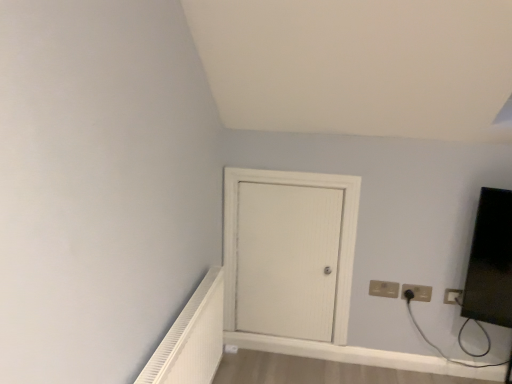
Question: Is white wood door at center completely or partially outside of white textured radiator at lower left?

Choices:
 (A) yes
 (B) no

Answer: (A)

Question: Can you confirm if white wood door at center is smaller than white textured radiator at lower left?

Choices:
 (A) yes
 (B) no

Answer: (A)

Question: Can you confirm if white wood door at center is thinner than white textured radiator at lower left?

Choices:
 (A) yes
 (B) no

Answer: (A)

Question: Is white wood door at center shorter than white textured radiator at lower left?

Choices:
 (A) yes
 (B) no

Answer: (B)

Question: Are white wood door at center and white textured radiator at lower left making contact?

Choices:
 (A) yes
 (B) no

Answer: (B)

Question: Are white wood door at center and white textured radiator at lower left far apart?

Choices:
 (A) no
 (B) yes

Answer: (A)

Question: From a real-world perspective, does white plastic electric outlet at upper right, the third electric outlet when ordered from left to right, sit lower than white wood door at center?

Choices:
 (A) no
 (B) yes

Answer: (B)

Question: Considering the relative sizes of white plastic electric outlet at upper right, marked as the 1th electric outlet in a right-to-left arrangement, and white wood door at center in the image provided, is white plastic electric outlet at upper right, marked as the 1th electric outlet in a right-to-left arrangement, bigger than white wood door at center?

Choices:
 (A) yes
 (B) no

Answer: (B)

Question: From a real-world perspective, is white plastic electric outlet at upper right, marked as the 1th electric outlet in a right-to-left arrangement, on top of white wood door at center?

Choices:
 (A) no
 (B) yes

Answer: (A)

Question: Considering the relative positions of white plastic electric outlet at upper right, the third electric outlet when ordered from left to right, and white wood door at center in the image provided, is white plastic electric outlet at upper right, the third electric outlet when ordered from left to right, to the left of white wood door at center from the viewer's perspective?

Choices:
 (A) no
 (B) yes

Answer: (A)

Question: Can you confirm if white plastic electric outlet at upper right, marked as the 1th electric outlet in a right-to-left arrangement, is taller than white wood door at center?

Choices:
 (A) no
 (B) yes

Answer: (A)

Question: Is white plastic electric outlet at upper right, marked as the 1th electric outlet in a right-to-left arrangement, smaller than white wood door at center?

Choices:
 (A) no
 (B) yes

Answer: (B)

Question: Is white plastic electric outlet at upper right, marked as the 1th electric outlet in a right-to-left arrangement, located outside matte black outlet at upper right, which is the second electric outlet in left-to-right order?

Choices:
 (A) no
 (B) yes

Answer: (B)